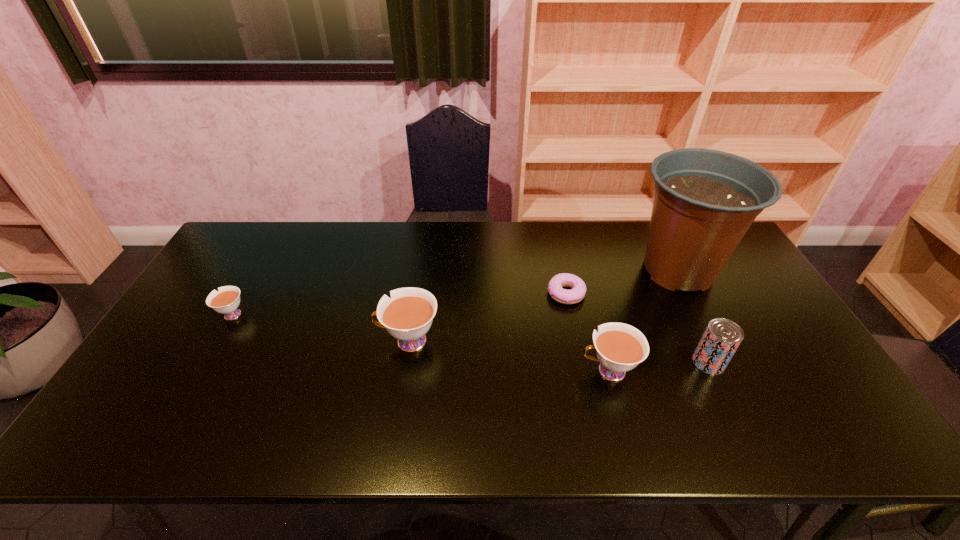
What are the coordinates of `free space located on the side of the second tallest teacup with the handle` in the screenshot? It's located at (536, 371).

At what (x,y) coordinates should I click in order to perform the action: click on free space located on the side of the second tallest teacup with the handle. Please return your answer as a coordinate pair (x, y). This screenshot has height=540, width=960. Looking at the image, I should click on (540, 371).

Locate an element on the screen. vacant space positioned on the side of the second tallest teacup with the handle is located at coordinates (473, 371).

Locate an element on the screen. The image size is (960, 540). free region located on the left of the flowerpot is located at coordinates (583, 270).

What are the coordinates of `vacant space located 0.120m on the right of the beer can` in the screenshot? It's located at (770, 362).

Locate an element on the screen. free space located on the back of the shortest object is located at coordinates (553, 230).

Where is `object positioned at the far edge`? This screenshot has width=960, height=540. object positioned at the far edge is located at coordinates (705, 200).

Image resolution: width=960 pixels, height=540 pixels. Find the location of `object that is at the near edge`. object that is at the near edge is located at coordinates (620, 347).

The image size is (960, 540). I want to click on object situated at the left edge, so click(x=226, y=301).

In order to click on object positioned at the right edge in this screenshot , I will do (x=705, y=200).